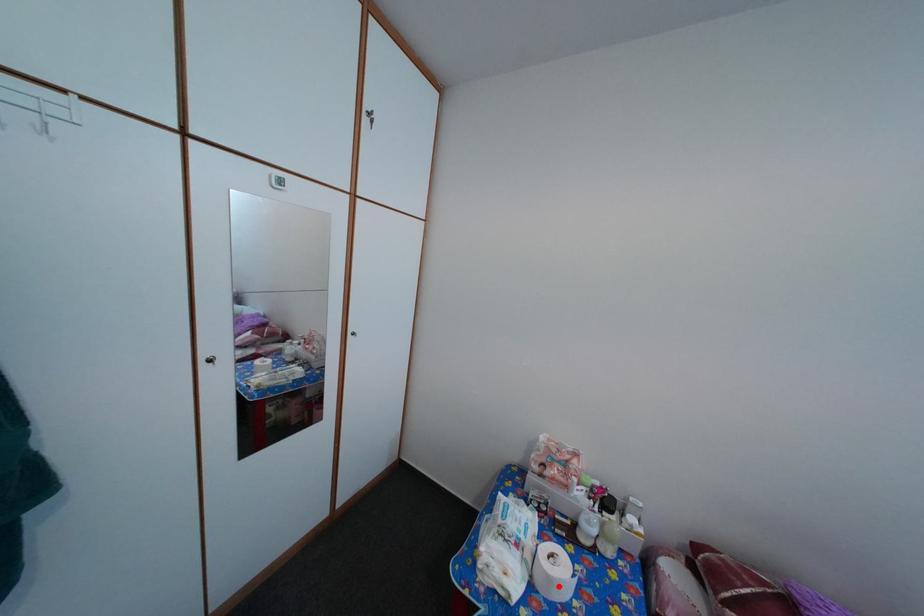
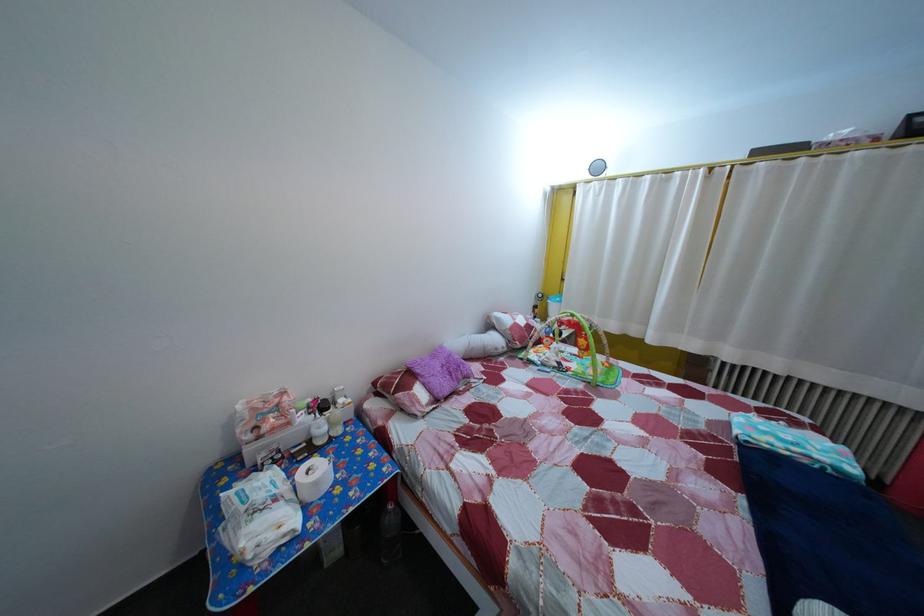
Question: I am providing you with two images of the same scene from different viewpoints. In image1, a red point is highlighted. Considering the same 3D point in image2, which of the following is correct?

Choices:
 (A) It is closer
 (B) It is farther

Answer: (A)